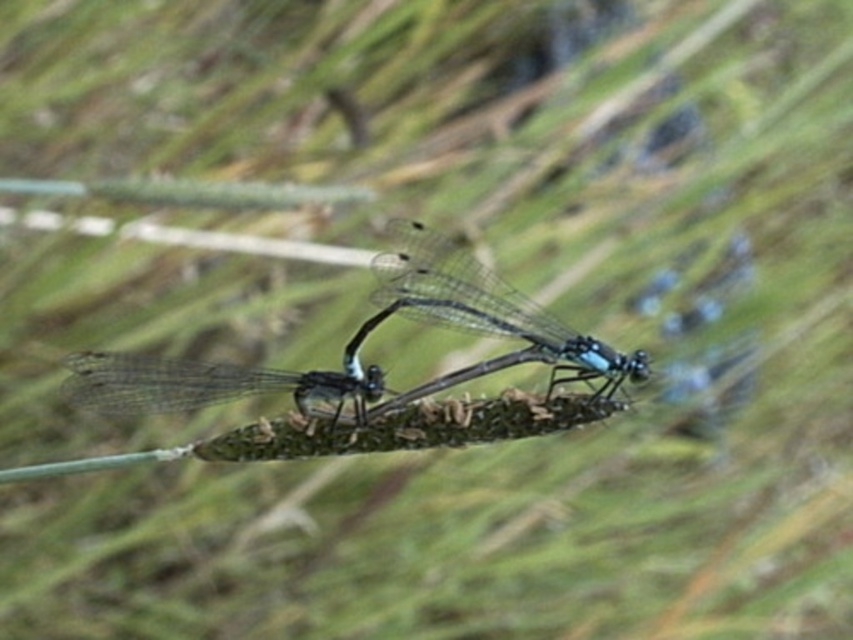
Question: Which of the following is the closest to the observer?

Choices:
 (A) (646, 376)
 (B) (326, 388)

Answer: (A)

Question: Considering the relative positions of translucent glass dragonfly at center and transparent glass dragonfly at center in the image provided, where is translucent glass dragonfly at center located with respect to transparent glass dragonfly at center?

Choices:
 (A) above
 (B) below

Answer: (A)

Question: Is translucent glass dragonfly at center positioned before transparent glass dragonfly at center?

Choices:
 (A) no
 (B) yes

Answer: (A)

Question: Which point is closer to the camera?

Choices:
 (A) translucent glass dragonfly at center
 (B) transparent glass dragonfly at center

Answer: (B)

Question: Is translucent glass dragonfly at center positioned in front of transparent glass dragonfly at center?

Choices:
 (A) yes
 (B) no

Answer: (B)